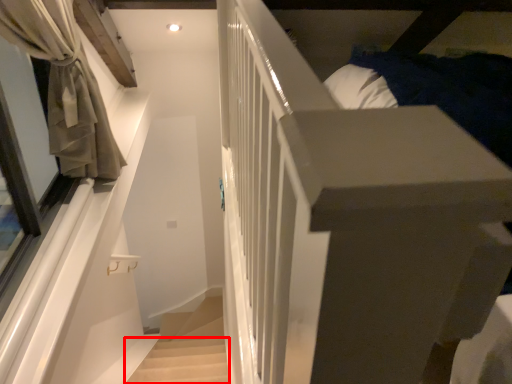
Question: Considering the relative positions of stairwell (annotated by the red box) and curtain in the image provided, where is stairwell (annotated by the red box) located with respect to the staircase?

Choices:
 (A) right
 (B) left

Answer: (A)